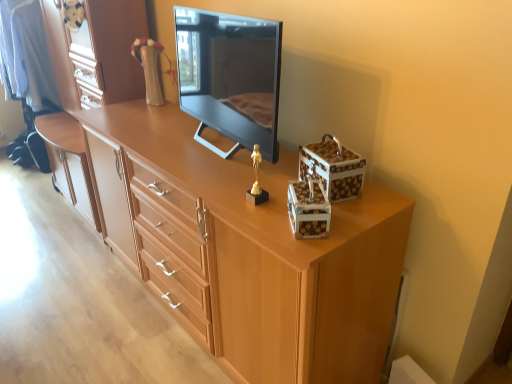
Locate an element on the screen. Image resolution: width=512 pixels, height=384 pixels. free area in between black glossy television at center and gold metallic statue at center is located at coordinates (228, 166).